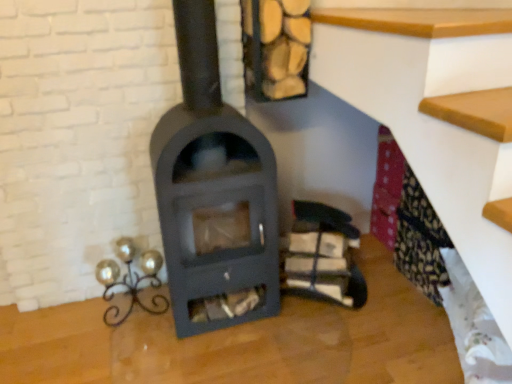
Locate an element on the screen. The image size is (512, 384). matte black wood burning stove at center is located at coordinates (213, 189).

Describe the element at coordinates (213, 189) in the screenshot. This screenshot has width=512, height=384. I see `matte black wood burning stove at center` at that location.

The width and height of the screenshot is (512, 384). What are the coordinates of `matte black wood burning stove at center` in the screenshot? It's located at (213, 189).